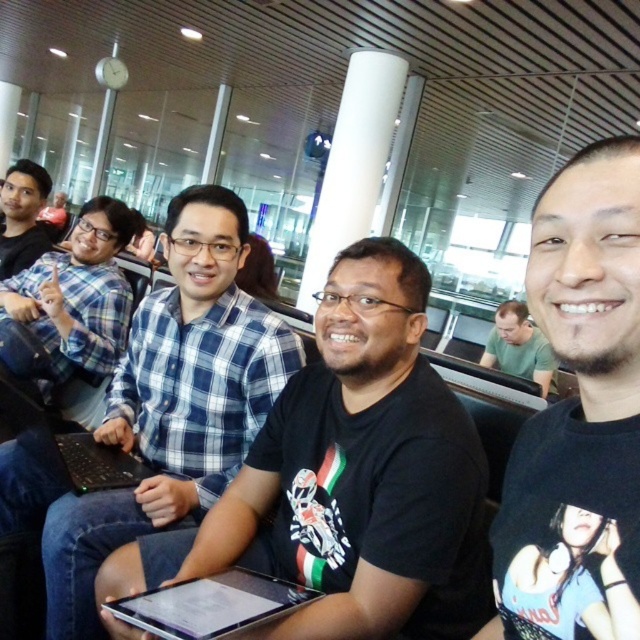
You are a photographer standing in the airport lounge and want to take a photo of the blue plaid shirt at center and the black matte laptop at center. If your camera has a minimum focus distance of 7 inches, will you need to move closer or farther away to capture both subjects clearly?

The blue plaid shirt at center is 7.30 inches from the black matte laptop at center. Since the minimum focus distance is 7 inches, you can stay at your current position because the distance between them is just beyond the minimum requirement, allowing both subjects to be in focus without needing to adjust your distance.

Based on the photo, where is the blue plaid shirt at center located in the image?

The blue plaid shirt at center is located at the 2D coordinates point (161, 410).